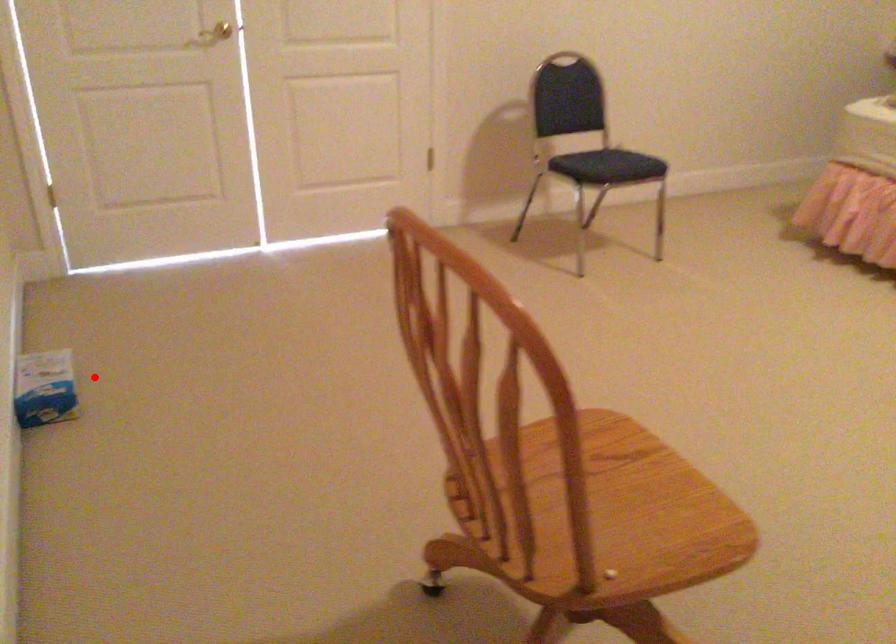
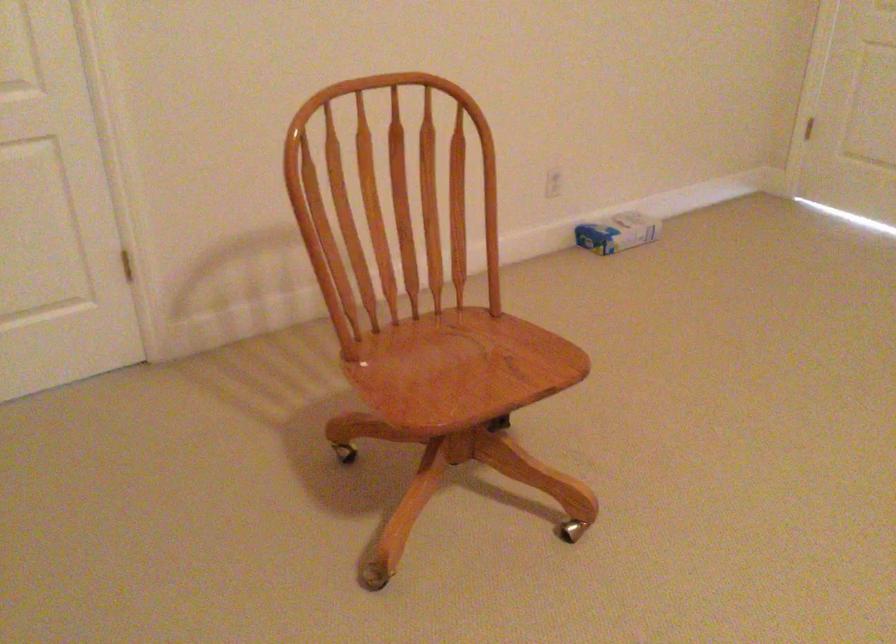
Find the pixel in the second image that matches the highlighted location in the first image.

(616, 232)